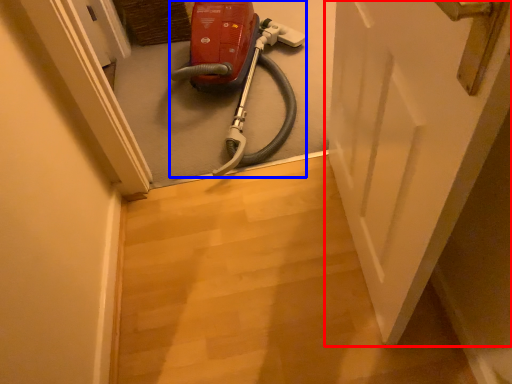
Question: Which of the following is the closest to the observer, door (highlighted by a red box) or equipment (highlighted by a blue box)?

Choices:
 (A) door
 (B) equipment

Answer: (A)